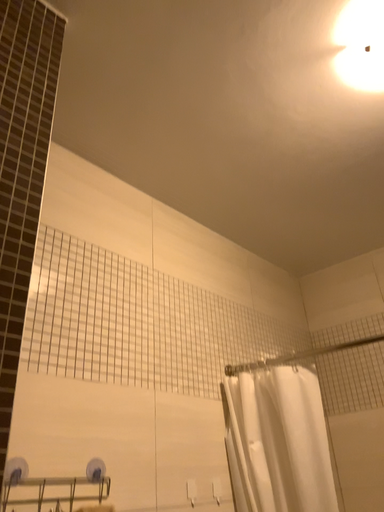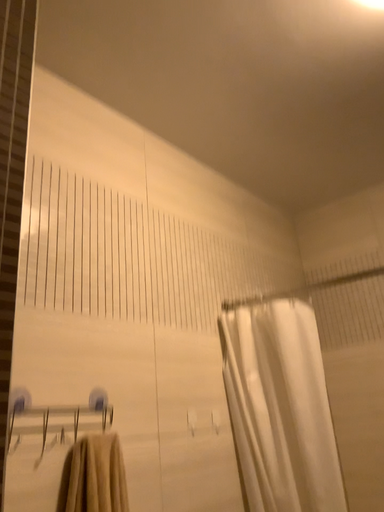
Question: Which way did the camera rotate in the video?

Choices:
 (A) rotated downward
 (B) rotated upward

Answer: (A)